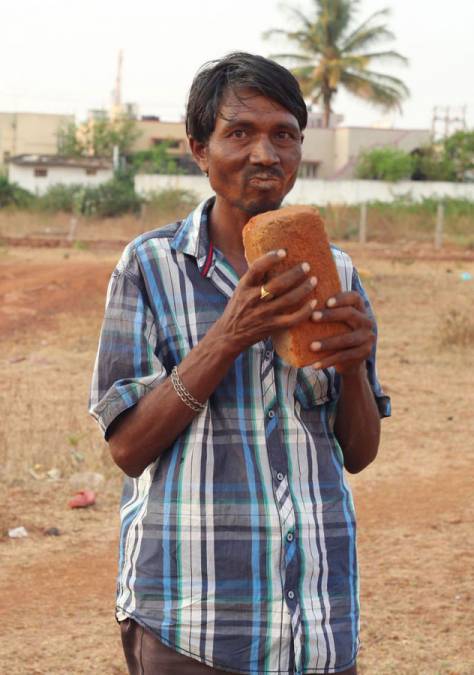
This screenshot has height=675, width=474. In order to click on box in this screenshot , I will do `click(326, 262)`.